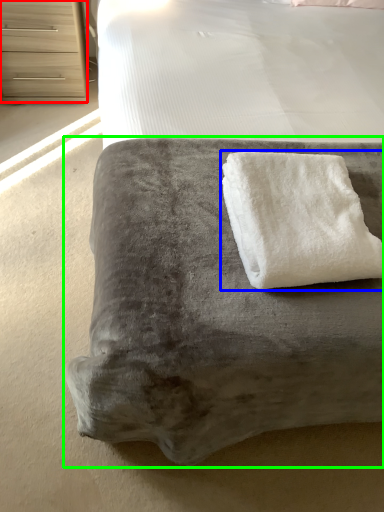
Question: Considering the real-world distances, which object is closest to chest of drawers (highlighted by a red box)? towel (highlighted by a blue box) or furniture (highlighted by a green box).

Choices:
 (A) towel
 (B) furniture

Answer: (B)